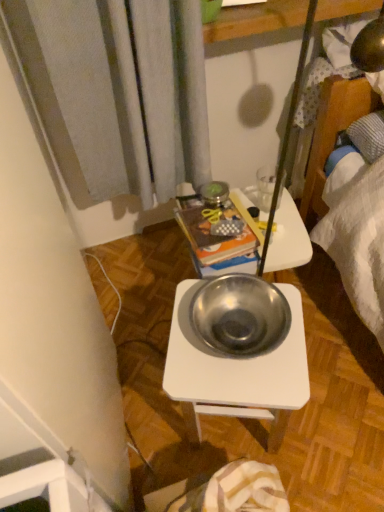
The height and width of the screenshot is (512, 384). Identify the location of vacant space in front of transparent glass at upper center. (283, 230).